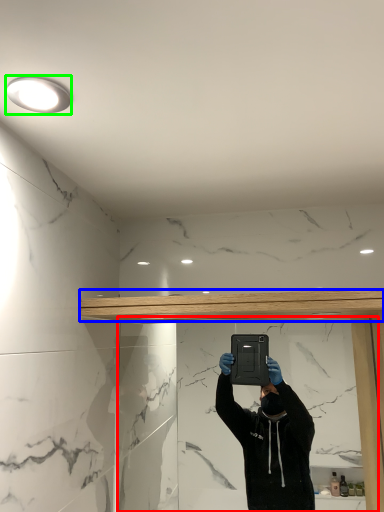
Question: Which object is positioned closest to mirror (highlighted by a red box)? Select from beam (highlighted by a blue box) and light fixture (highlighted by a green box).

Choices:
 (A) beam
 (B) light fixture

Answer: (A)